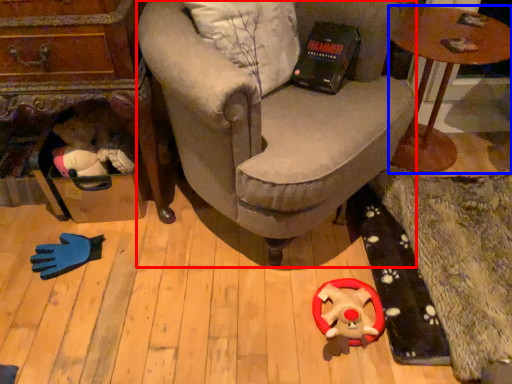
Question: Which object appears closest to the camera in this image, chair (highlighted by a red box) or table (highlighted by a blue box)?

Choices:
 (A) chair
 (B) table

Answer: (A)